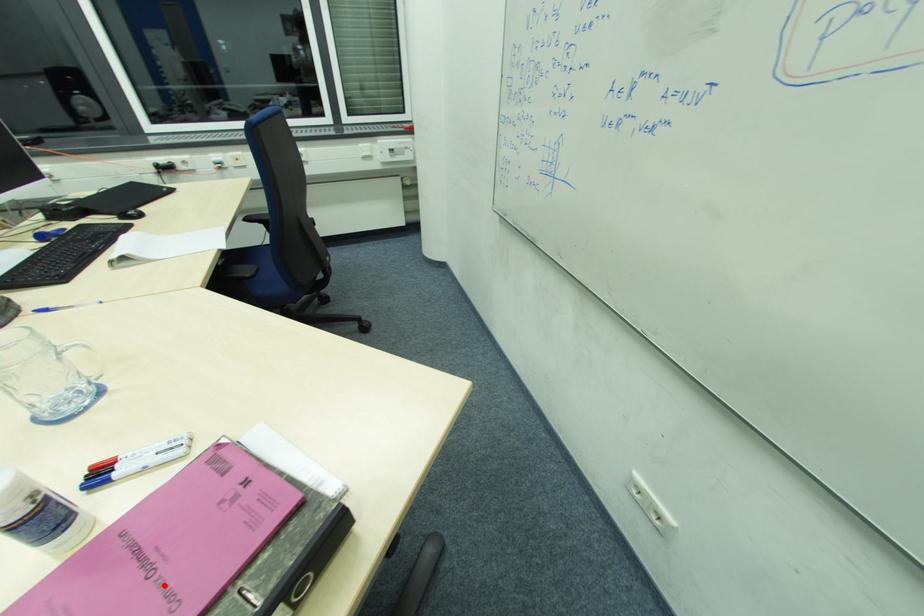
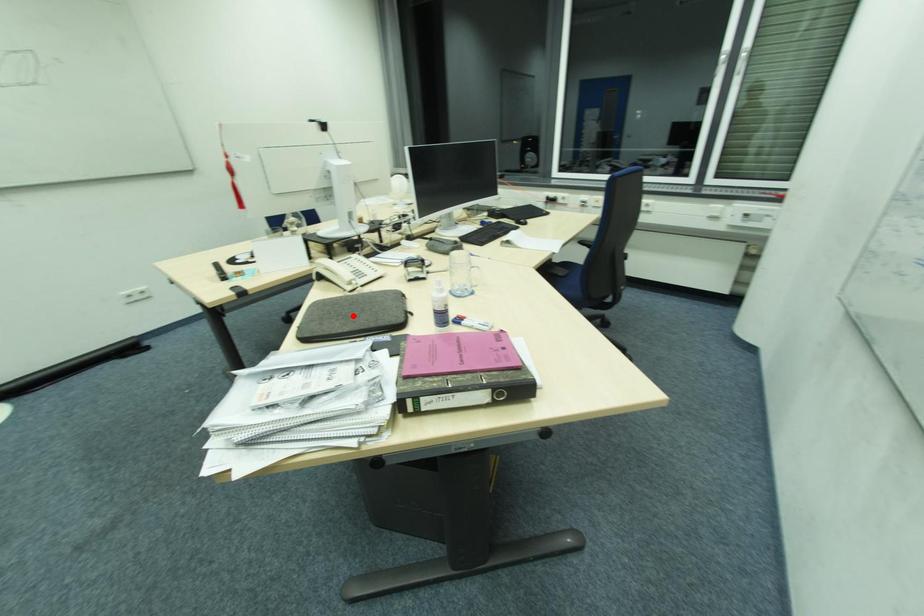
Consider the image. I am providing you with two images of the same scene from different viewpoints. A red point is marked on the first image and another point is marked on the second image. Is the red point in image1 aligned with the point shown in image2?

No